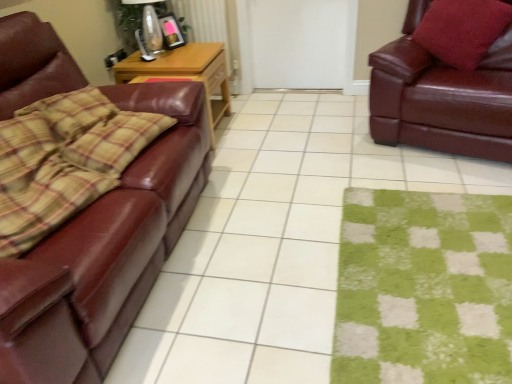
Question: Does matte brown leather couch at left have a greater height compared to shiny brown leather couch at left, marked as the 1th studio couch in a left-to-right arrangement?

Choices:
 (A) yes
 (B) no

Answer: (B)

Question: Is matte brown leather couch at left smaller than shiny brown leather couch at left, the 2th studio couch viewed from the right?

Choices:
 (A) no
 (B) yes

Answer: (B)

Question: From a real-world perspective, is matte brown leather couch at left below shiny brown leather couch at left, marked as the 1th studio couch in a left-to-right arrangement?

Choices:
 (A) yes
 (B) no

Answer: (A)

Question: Does matte brown leather couch at left appear on the left side of shiny brown leather couch at left, the 2th studio couch viewed from the right?

Choices:
 (A) yes
 (B) no

Answer: (B)

Question: Considering the relative sizes of matte brown leather couch at left and shiny brown leather couch at left, marked as the 1th studio couch in a left-to-right arrangement, in the image provided, is matte brown leather couch at left wider than shiny brown leather couch at left, marked as the 1th studio couch in a left-to-right arrangement,?

Choices:
 (A) yes
 (B) no

Answer: (A)

Question: From their relative heights in the image, would you say velvet red pillow at upper right is taller or shorter than woodenobject at left?

Choices:
 (A) tall
 (B) short

Answer: (B)

Question: Choose the correct answer: Is velvet red pillow at upper right inside woodenobject at left or outside it?

Choices:
 (A) outside
 (B) inside

Answer: (A)

Question: Considering the positions of velvet red pillow at upper right and woodenobject at left in the image, is velvet red pillow at upper right bigger or smaller than woodenobject at left?

Choices:
 (A) big
 (B) small

Answer: (B)

Question: From the image's perspective, relative to woodenobject at left, is velvet red pillow at upper right above or below?

Choices:
 (A) above
 (B) below

Answer: (A)

Question: Considering the positions of point (237, 244) and point (496, 33), is point (237, 244) closer or farther from the camera than point (496, 33)?

Choices:
 (A) farther
 (B) closer

Answer: (B)

Question: Would you say matte brown leather couch at left is to the left or to the right of velvet red pillow at upper right in the picture?

Choices:
 (A) right
 (B) left

Answer: (B)

Question: Choose the correct answer: Is matte brown leather couch at left inside velvet red pillow at upper right or outside it?

Choices:
 (A) outside
 (B) inside

Answer: (A)

Question: In terms of height, does matte brown leather couch at left look taller or shorter compared to velvet red pillow at upper right?

Choices:
 (A) short
 (B) tall

Answer: (A)

Question: Is white matte door at center wider or thinner than green fuzzy mat at lower right?

Choices:
 (A) thin
 (B) wide

Answer: (A)

Question: Based on their sizes in the image, would you say white matte door at center is bigger or smaller than green fuzzy mat at lower right?

Choices:
 (A) small
 (B) big

Answer: (B)